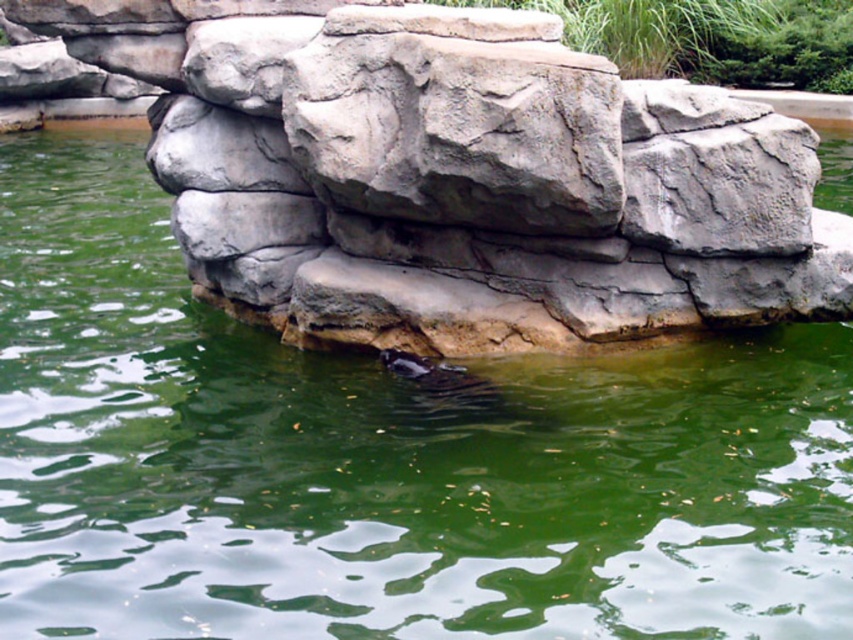
Is gray stone rock at center to the right of gray rough rock at center from the viewer's perspective?

No, gray stone rock at center is not to the right of gray rough rock at center.

Between gray stone rock at center and gray rough rock at center, which one has less height?

gray rough rock at center is shorter.

Which is in front, point (194, 241) or point (396, 140)?

Point (396, 140) is in front.

Identify the location of gray stone rock at center. The width and height of the screenshot is (853, 640). (457, 177).

Is point (564, 60) positioned after point (397, 371)?

No, it is not.

Is gray rough rock at center above shiny brown otter at center?

Indeed, gray rough rock at center is positioned over shiny brown otter at center.

Identify the location of gray rough rock at center. (456, 120).

Is point (160, 3) closer to camera compared to point (405, 371)?

No, (160, 3) is behind (405, 371).

Is gray stone rock at center bigger than shiny brown otter at center?

Yes, gray stone rock at center is bigger than shiny brown otter at center.

The height and width of the screenshot is (640, 853). What are the coordinates of `gray stone rock at center` in the screenshot? It's located at (457, 177).